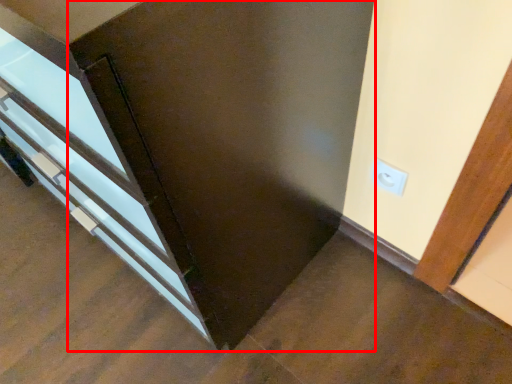
Question: From the image's perspective, where is door (annotated by the red box) located relative to electric outlet?

Choices:
 (A) below
 (B) above

Answer: (B)